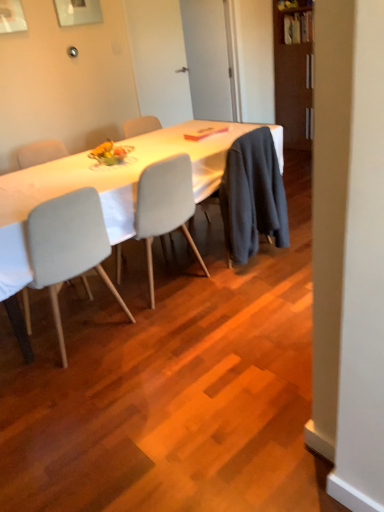
You are a GUI agent. You are given a task and a screenshot of the screen. Output one action in this format:
    pyautogui.click(x=<x>, y=<y>)
    Task: Click on the vacant space to the right of light gray fabric chair at center, which ranks as the 1th chair in right-to-left order
    The height and width of the screenshot is (512, 384).
    Given the screenshot: What is the action you would take?
    pyautogui.click(x=240, y=288)